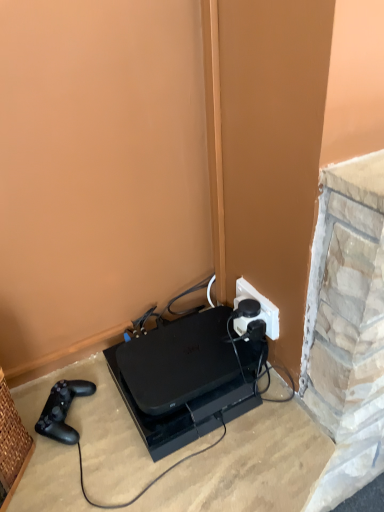
What is the approximate height of black plastic gaming console at lower center?

2.88 inches.

Describe the element at coordinates (259, 311) in the screenshot. The image size is (384, 512). I see `white plastic power plugs and sockets at center-right` at that location.

Find the location of `white plastic power plugs and sockets at center-right`. white plastic power plugs and sockets at center-right is located at coordinates (259, 311).

Locate an element on the screen. This screenshot has width=384, height=512. black plastic gaming console at lower center is located at coordinates (184, 379).

From the image's perspective, between black matte game controller at lower left and white plastic power plugs and sockets at center-right, which one is located above?

white plastic power plugs and sockets at center-right appears higher in the image.

Considering the points (51, 428) and (238, 282), which point is behind, point (51, 428) or point (238, 282)?

The point (238, 282) is farther from the camera.

How different are the orientations of black matte game controller at lower left and white plastic power plugs and sockets at center-right in degrees?

black matte game controller at lower left and white plastic power plugs and sockets at center-right are facing 142 degrees away from each other.

Relative to white plastic power plugs and sockets at center-right, is black matte game controller at lower left in front or behind?

black matte game controller at lower left is positioned closer to the viewer than white plastic power plugs and sockets at center-right.

From a real-world perspective, which object stands above the other?

In real-world perspective, white plastic power plugs and sockets at center-right is above.

Which point is more distant from viewer, (x=268, y=302) or (x=70, y=441)?

Point (x=268, y=302)

From the image's perspective, which one is positioned higher, white plastic power plugs and sockets at center-right or black matte game controller at lower left?

white plastic power plugs and sockets at center-right, from the image's perspective.

Is white plastic power plugs and sockets at center-right in front of or behind black plastic gaming console at lower center in the image?

In the image, white plastic power plugs and sockets at center-right appears behind black plastic gaming console at lower center.

How many degrees apart are the facing directions of white plastic power plugs and sockets at center-right and black plastic gaming console at lower center?

The facing directions of white plastic power plugs and sockets at center-right and black plastic gaming console at lower center are 90.5 degrees apart.

Is white plastic power plugs and sockets at center-right next to black plastic gaming console at lower center?

→ white plastic power plugs and sockets at center-right and black plastic gaming console at lower center are not in contact.

Could black plastic gaming console at lower center be considered to be inside white plastic power plugs and sockets at center-right?

No, black plastic gaming console at lower center is not inside white plastic power plugs and sockets at center-right.

Is black matte game controller at lower left at the right side of black plastic gaming console at lower center?

No.

From a real-world perspective, is black matte game controller at lower left on top of black plastic gaming console at lower center?

Correct, in the physical world, black matte game controller at lower left is higher than black plastic gaming console at lower center.

Considering the positions of objects black matte game controller at lower left and black plastic gaming console at lower center in the image provided, who is in front, black matte game controller at lower left or black plastic gaming console at lower center?

black plastic gaming console at lower center is more forward.

Which is in front, black plastic gaming console at lower center or black matte game controller at lower left?

black plastic gaming console at lower center.

The image size is (384, 512). In the image, there is a black matte game controller at lower left. In order to click on appliance above it (from the image's perspective) in this screenshot , I will do `click(184, 379)`.

Which point is more forward, (156, 375) or (54, 436)?

Positioned in front is point (54, 436).

Considering the sizes of objects black plastic gaming console at lower center and black matte game controller at lower left in the image provided, who is bigger, black plastic gaming console at lower center or black matte game controller at lower left?

black plastic gaming console at lower center.

From the image's perspective, would you say black plastic gaming console at lower center is positioned over white plastic power plugs and sockets at center-right?

No, from the image's perspective, black plastic gaming console at lower center is not above white plastic power plugs and sockets at center-right.

From a real-world perspective, does black plastic gaming console at lower center sit lower than white plastic power plugs and sockets at center-right?

Correct, in the physical world, black plastic gaming console at lower center is lower than white plastic power plugs and sockets at center-right.

Is point (213, 337) farther from viewer compared to point (236, 298)?

No, it is in front of (236, 298).

Identify the location of game controller that appears below the white plastic power plugs and sockets at center-right (from a real-world perspective). The width and height of the screenshot is (384, 512). (62, 410).

Where is `power plugs and sockets behind the black matte game controller at lower left`? power plugs and sockets behind the black matte game controller at lower left is located at coordinates (259, 311).

Based on their spatial positions, is black matte game controller at lower left or white plastic power plugs and sockets at center-right closer to black plastic gaming console at lower center?

The object closer to black plastic gaming console at lower center is white plastic power plugs and sockets at center-right.

Considering their positions, is black plastic gaming console at lower center positioned closer to black matte game controller at lower left than white plastic power plugs and sockets at center-right?

black plastic gaming console at lower center.

Which object lies nearer to the anchor point white plastic power plugs and sockets at center-right, black matte game controller at lower left or black plastic gaming console at lower center?

black plastic gaming console at lower center is closer to white plastic power plugs and sockets at center-right.

Estimate the real-world distances between objects in this image. Which object is closer to black plastic gaming console at lower center, white plastic power plugs and sockets at center-right or black matte game controller at lower left?

white plastic power plugs and sockets at center-right is positioned closer to the anchor black plastic gaming console at lower center.

Estimate the real-world distances between objects in this image. Which object is closer to black matte game controller at lower left, white plastic power plugs and sockets at center-right or black plastic gaming console at lower center?

The object closer to black matte game controller at lower left is black plastic gaming console at lower center.

Looking at the image, which one is located further to white plastic power plugs and sockets at center-right, black plastic gaming console at lower center or black matte game controller at lower left?

black matte game controller at lower left lies further to white plastic power plugs and sockets at center-right than the other object.

This screenshot has width=384, height=512. I want to click on appliance situated between black matte game controller at lower left and white plastic power plugs and sockets at center-right from left to right, so click(184, 379).